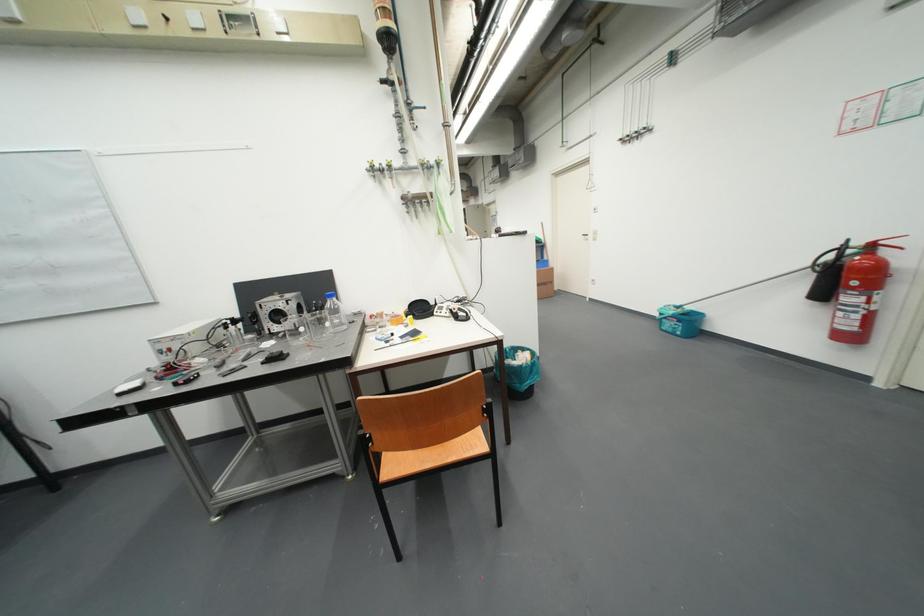
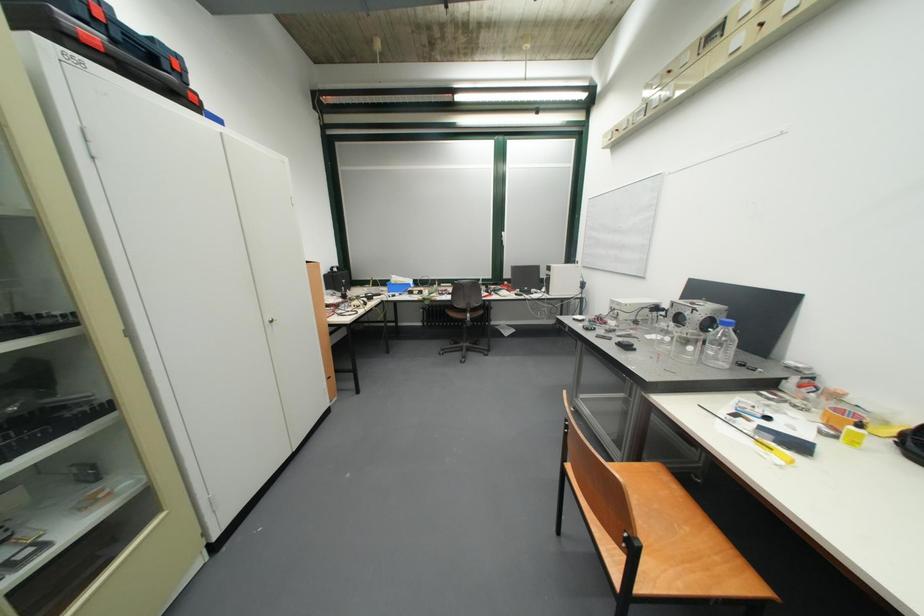
The first image is from the beginning of the video and the second image is from the end. How did the camera likely rotate when shooting the video?

The camera's rotation is toward left-down.